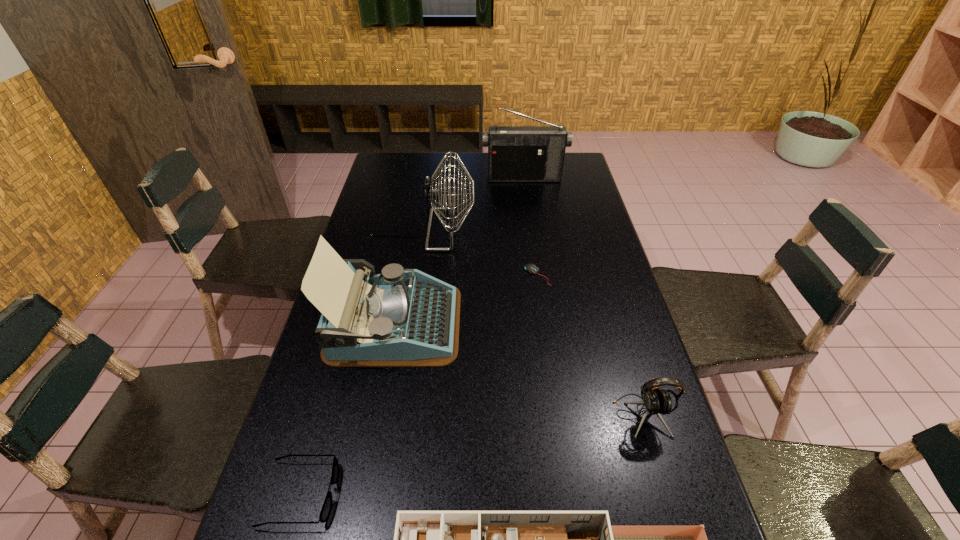
Where is `vacant space positioned 0.390m on the typing side of the fifth shortest object`? vacant space positioned 0.390m on the typing side of the fifth shortest object is located at coordinates (598, 323).

This screenshot has width=960, height=540. I want to click on vacant space located on the back of the earphone, so click(x=623, y=354).

Find the location of a particular element. free space located 0.400m on the front-facing side of the spectacles is located at coordinates (531, 494).

I want to click on free space located 0.080m on the front of the mouse, so click(x=541, y=305).

Locate an element on the screen. object at the far edge is located at coordinates (515, 153).

At what (x,y) coordinates should I click in order to perform the action: click on fan located in the left edge section of the desktop. Please return your answer as a coordinate pair (x, y). Looking at the image, I should click on (432, 192).

Identify the location of typewriter located in the left edge section of the desktop. This screenshot has width=960, height=540. (398, 318).

Where is `spectacles at the left edge`? spectacles at the left edge is located at coordinates (327, 505).

At what (x,y) coordinates should I click in order to perform the action: click on radio receiver that is at the right edge. Please return your answer as a coordinate pair (x, y). The width and height of the screenshot is (960, 540). Looking at the image, I should click on pos(515,153).

Where is `earphone located at the right edge`? The height and width of the screenshot is (540, 960). earphone located at the right edge is located at coordinates (656, 401).